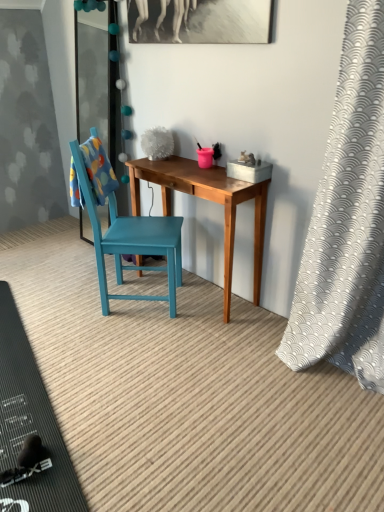
Locate an element on the screen. The height and width of the screenshot is (512, 384). space that is in front of teal wooden chair at center is located at coordinates (134, 341).